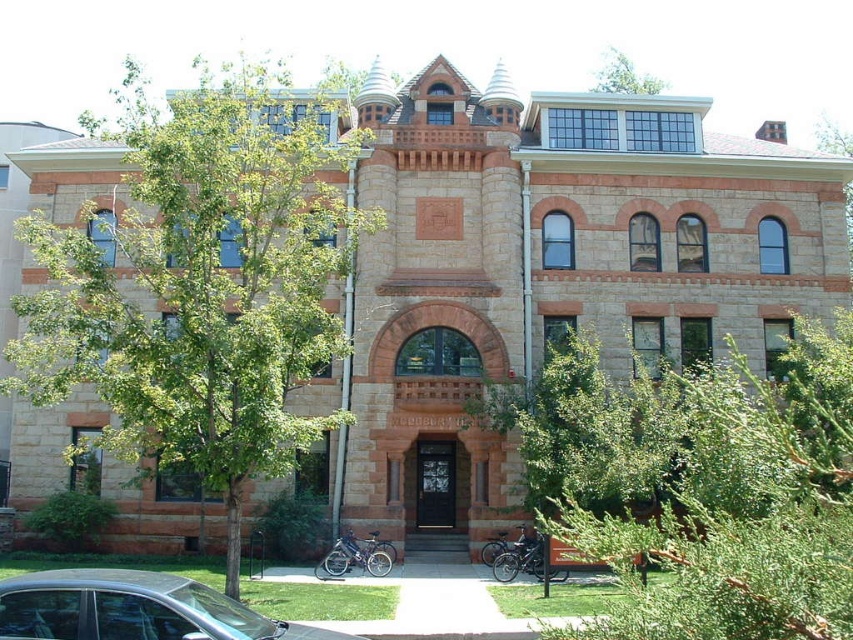
Question: Which object appears farthest from the camera in this image?

Choices:
 (A) green leafy tree at upper center
 (B) green leafy tree at left
 (C) silver metallic car at lower left

Answer: (A)

Question: In this image, where is silver metallic car at lower left located relative to green leafy tree at upper center?

Choices:
 (A) below
 (B) above

Answer: (A)

Question: Is green leafy tree at left to the left of green leafy tree at upper center from the viewer's perspective?

Choices:
 (A) yes
 (B) no

Answer: (A)

Question: Which point is farther from the camera taking this photo?

Choices:
 (A) (614, 84)
 (B) (39, 340)

Answer: (A)

Question: Can you confirm if green leafy tree at left is bigger than silver metallic car at lower left?

Choices:
 (A) no
 (B) yes

Answer: (B)

Question: Which point is closer to the camera?

Choices:
 (A) (67, 616)
 (B) (613, 77)
 (C) (274, 147)

Answer: (A)